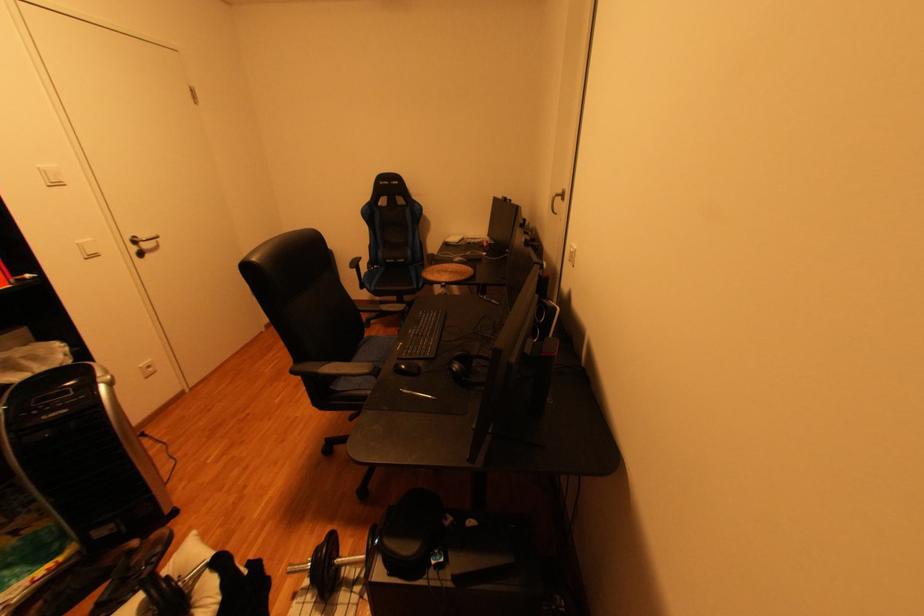
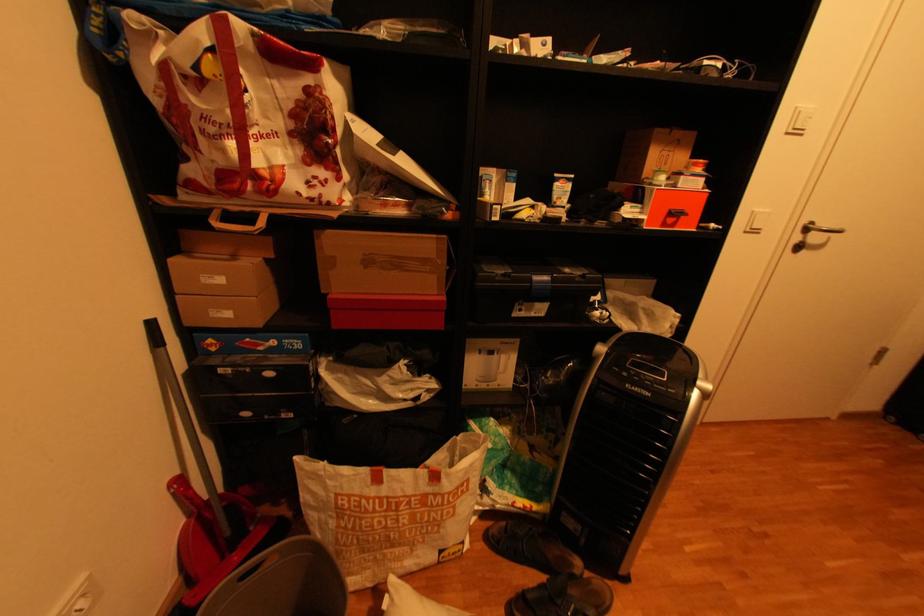
In the second image, find the point that corresponds to (59,187) in the first image.

(796, 134)